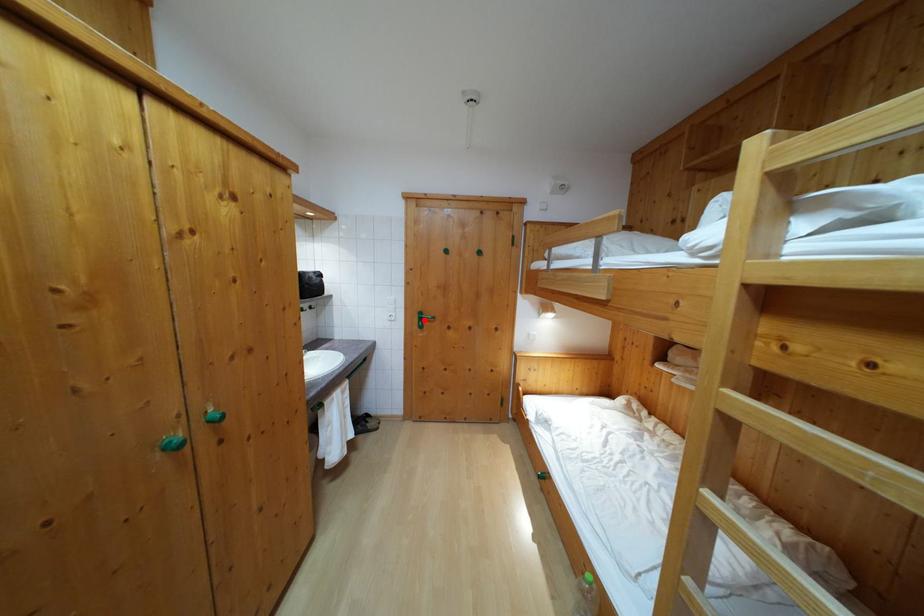
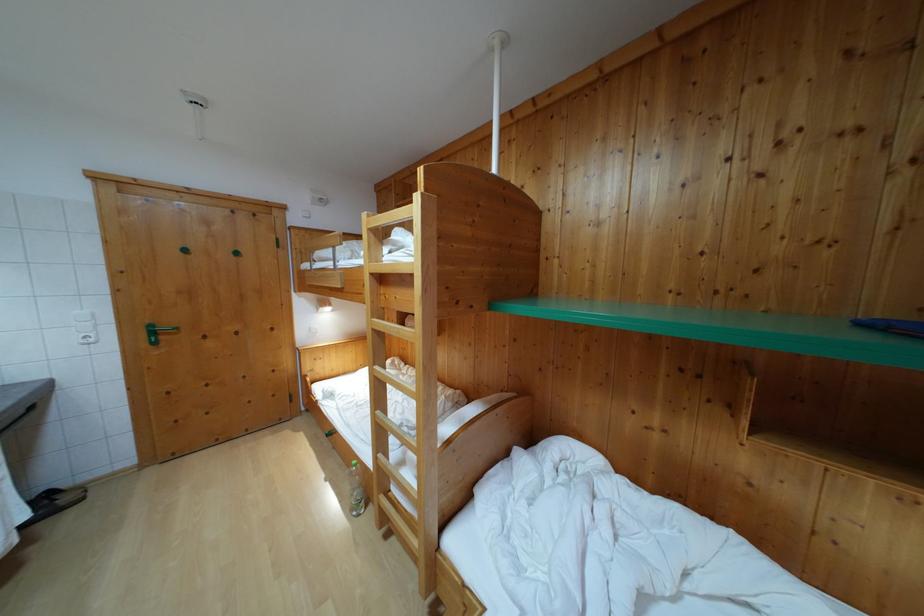
In the second image, find the point that corresponds to the highlighted location in the first image.

(155, 333)